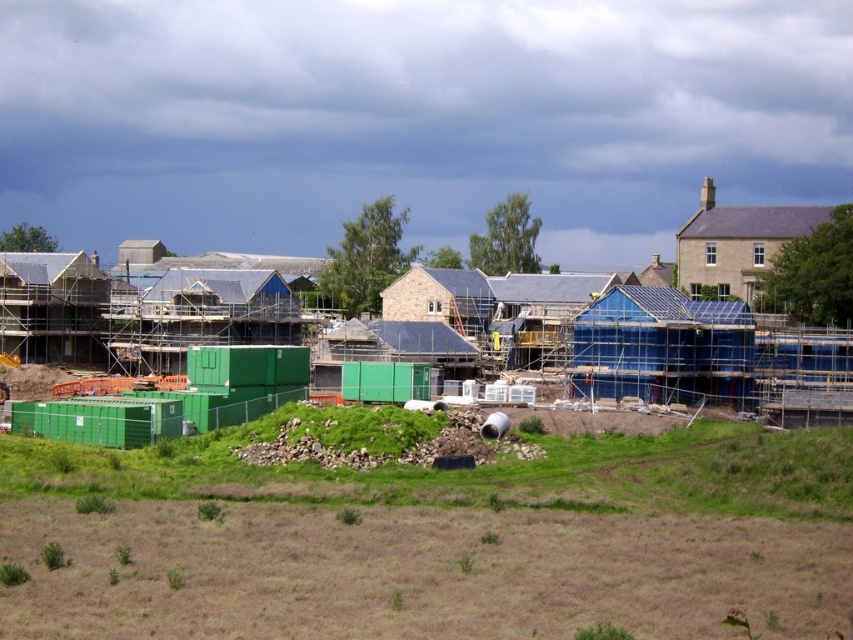
Does green grass at lower center appear on the right side of green plastic containers at center?

Yes, green grass at lower center is to the right of green plastic containers at center.

The image size is (853, 640). I want to click on green grass at lower center, so click(428, 536).

Where is `green grass at lower center`? This screenshot has width=853, height=640. green grass at lower center is located at coordinates (428, 536).